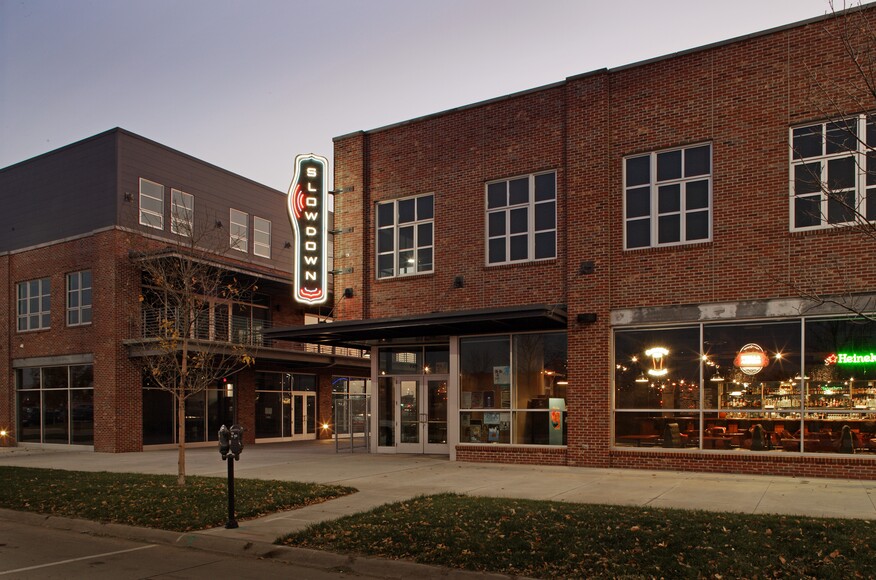
Where is `door`? This screenshot has width=876, height=580. door is located at coordinates (414, 407).